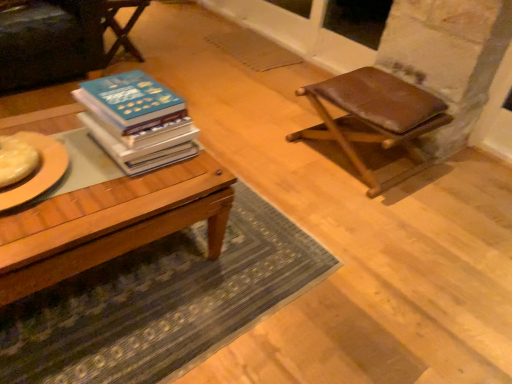
Find the location of a particular element. The height and width of the screenshot is (384, 512). free spot below brown leather stool at right (from a real-world perspective) is located at coordinates (358, 157).